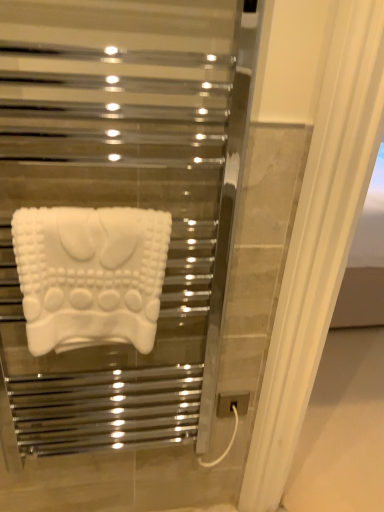
Describe the element at coordinates (232, 403) in the screenshot. The width and height of the screenshot is (384, 512). I see `gray matte electric outlet at lower right` at that location.

This screenshot has width=384, height=512. Identify the location of gray matte electric outlet at lower right. (232, 403).

Where is `white matte towel at center`? This screenshot has width=384, height=512. white matte towel at center is located at coordinates (90, 275).

Describe the element at coordinates (90, 275) in the screenshot. I see `white matte towel at center` at that location.

What is the approximate height of white matte towel at center?

The height of white matte towel at center is 30.86 centimeters.

Locate an element on the screen. gray matte electric outlet at lower right is located at coordinates (232, 403).

Visually, is white matte towel at center positioned to the left or to the right of gray matte electric outlet at lower right?

In the image, white matte towel at center appears on the left side of gray matte electric outlet at lower right.

Between white matte towel at center and gray matte electric outlet at lower right, which one is positioned in front?

Positioned in front is white matte towel at center.

Does point (60, 216) come behind point (243, 396)?

No, (60, 216) is in front of (243, 396).

From the image's perspective, which object appears higher, white matte towel at center or gray matte electric outlet at lower right?

white matte towel at center appears higher in the image.

From a real-world perspective, is white matte towel at center positioned above or below gray matte electric outlet at lower right?

white matte towel at center is situated higher than gray matte electric outlet at lower right in the real world.

Considering the relative sizes of white matte towel at center and gray matte electric outlet at lower right in the image provided, is white matte towel at center wider than gray matte electric outlet at lower right?

Indeed, white matte towel at center has a greater width compared to gray matte electric outlet at lower right.

In terms of height, does white matte towel at center look taller or shorter compared to gray matte electric outlet at lower right?

white matte towel at center is taller than gray matte electric outlet at lower right.

Consider the image. Who is bigger, white matte towel at center or gray matte electric outlet at lower right?

Bigger between the two is white matte towel at center.

Is white matte towel at center completely or partially outside of gray matte electric outlet at lower right?

Yes, white matte towel at center is outside of gray matte electric outlet at lower right.

Is white matte towel at center touching gray matte electric outlet at lower right?

white matte towel at center is not next to gray matte electric outlet at lower right, and they're not touching.

Does white matte towel at center turn towards gray matte electric outlet at lower right?

No, white matte towel at center is not turned towards gray matte electric outlet at lower right.

What's the angular difference between white matte towel at center and gray matte electric outlet at lower right's facing directions?

0.00797 degrees.

I want to click on towel that is on the left side of gray matte electric outlet at lower right, so click(x=90, y=275).

Between gray matte electric outlet at lower right and white matte towel at center, which one appears on the left side from the viewer's perspective?

white matte towel at center is more to the left.

Between gray matte electric outlet at lower right and white matte towel at center, which one is positioned behind?

Positioned behind is gray matte electric outlet at lower right.

Does point (242, 412) come in front of point (26, 278)?

No, (242, 412) is further to viewer.

From the image's perspective, is gray matte electric outlet at lower right above or below white matte towel at center?

Clearly, from the image's perspective, gray matte electric outlet at lower right is below white matte towel at center.

From a real-world perspective, is gray matte electric outlet at lower right located beneath white matte towel at center?

Yes.

Looking at this image, can you confirm if gray matte electric outlet at lower right is wider than white matte towel at center?

No, gray matte electric outlet at lower right is not wider than white matte towel at center.

Does gray matte electric outlet at lower right have a greater height compared to white matte towel at center?

In fact, gray matte electric outlet at lower right may be shorter than white matte towel at center.

Considering the sizes of gray matte electric outlet at lower right and white matte towel at center in the image, is gray matte electric outlet at lower right bigger or smaller than white matte towel at center?

gray matte electric outlet at lower right is smaller than white matte towel at center.

Would you say gray matte electric outlet at lower right is inside or outside white matte towel at center?

gray matte electric outlet at lower right is outside white matte towel at center.

Is there a large distance between gray matte electric outlet at lower right and white matte towel at center?

gray matte electric outlet at lower right is near white matte towel at center, not far away.

Is gray matte electric outlet at lower right facing towards white matte towel at center?

No, gray matte electric outlet at lower right is not facing towards white matte towel at center.

How many degrees apart are the facing directions of gray matte electric outlet at lower right and white matte towel at center?

The angular difference between gray matte electric outlet at lower right and white matte towel at center is 0.00797 degrees.

At what (x,y) coordinates should I click in order to perform the action: click on towel in front of the gray matte electric outlet at lower right. Please return your answer as a coordinate pair (x, y). Looking at the image, I should click on (90, 275).

Where is `electric outlet lying behind the white matte towel at center`? electric outlet lying behind the white matte towel at center is located at coordinates (232, 403).

Image resolution: width=384 pixels, height=512 pixels. I want to click on towel to the left of gray matte electric outlet at lower right, so click(90, 275).